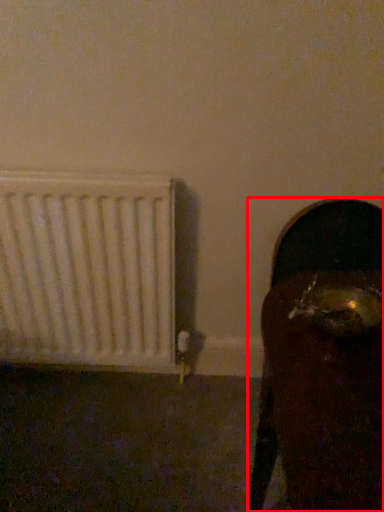
Question: From the image's perspective, considering the relative positions of furniture (annotated by the red box) and radiator in the image provided, where is furniture (annotated by the red box) located with respect to the staircase?

Choices:
 (A) above
 (B) below

Answer: (B)